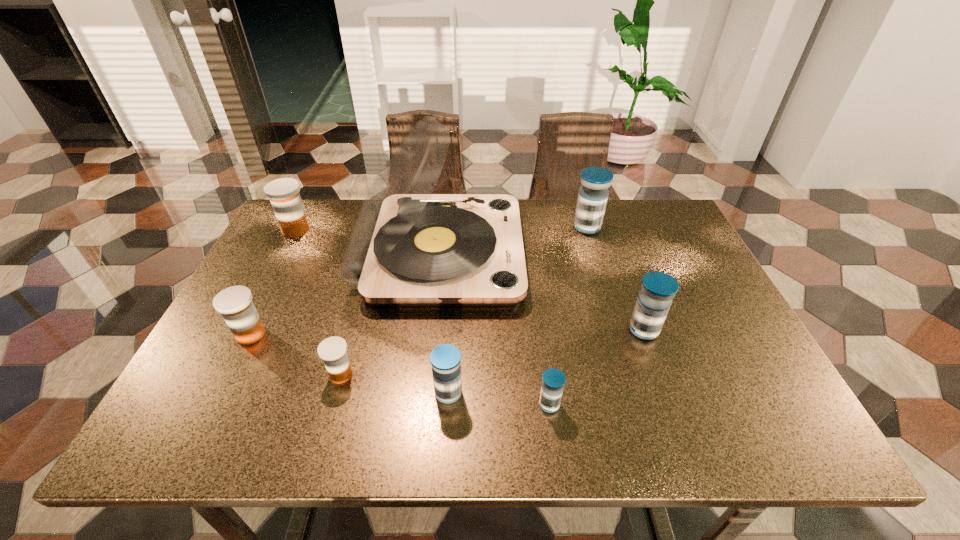
Image resolution: width=960 pixels, height=540 pixels. In order to click on record player in this screenshot , I will do `click(409, 247)`.

Where is `the farthest blue medicine`? The image size is (960, 540). the farthest blue medicine is located at coordinates (593, 194).

This screenshot has width=960, height=540. What are the coordinates of `the tallest medicine` in the screenshot? It's located at (593, 194).

The image size is (960, 540). Find the location of `the biggest orange medicine`. the biggest orange medicine is located at coordinates (284, 195).

The height and width of the screenshot is (540, 960). I want to click on the second biggest blue medicine, so click(x=654, y=300).

Find the location of `the second nearest orange medicine`. the second nearest orange medicine is located at coordinates (235, 304).

I want to click on the fourth medicine from left to right, so click(445, 359).

Where is `the second smallest blue medicine`? This screenshot has width=960, height=540. the second smallest blue medicine is located at coordinates (445, 359).

This screenshot has height=540, width=960. I want to click on the smallest orange medicine, so click(x=333, y=351).

You are a GUI agent. You are given a task and a screenshot of the screen. Output one action in this format:
    pyautogui.click(x=<x>, y=<y>)
    Task: Click on the fifth medicine from right to left
    The height and width of the screenshot is (540, 960).
    Given the screenshot: What is the action you would take?
    pyautogui.click(x=333, y=351)